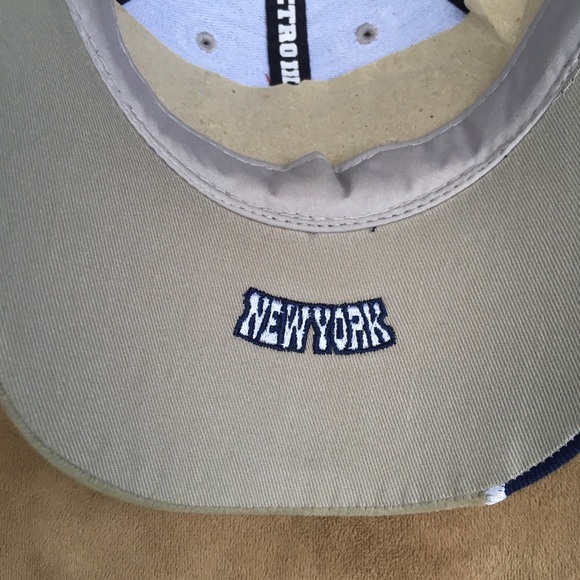
Where is `applique`? Image resolution: width=580 pixels, height=580 pixels. applique is located at coordinates (296, 313).